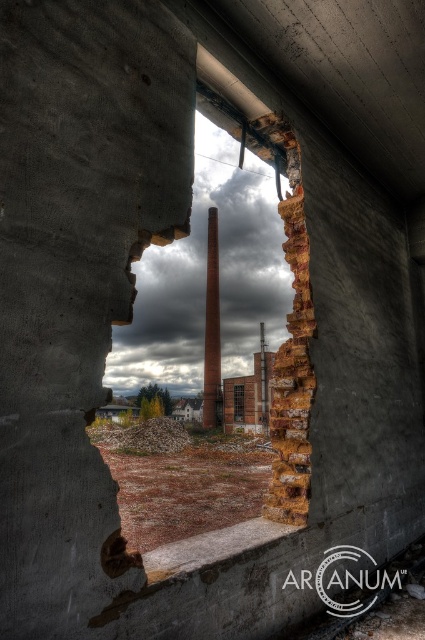
Question: Which object appears farthest from the camera in this image?

Choices:
 (A) rusty metal hole at center
 (B) smooth concrete pillar at center

Answer: (B)

Question: Which of these objects is positioned closest to the transparent glass window at center?

Choices:
 (A) rusty metal hole at center
 (B) smooth concrete pillar at center

Answer: (B)

Question: Does rusty metal hole at center appear over smooth concrete pillar at center?

Choices:
 (A) yes
 (B) no

Answer: (B)

Question: Which point is closer to the camera?

Choices:
 (A) (289, 157)
 (B) (235, 388)
 (C) (209, 253)

Answer: (A)

Question: Does smooth concrete pillar at center appear under transparent glass window at center?

Choices:
 (A) yes
 (B) no

Answer: (B)

Question: Can you confirm if rusty metal hole at center is positioned to the left of smooth concrete pillar at center?

Choices:
 (A) yes
 (B) no

Answer: (B)